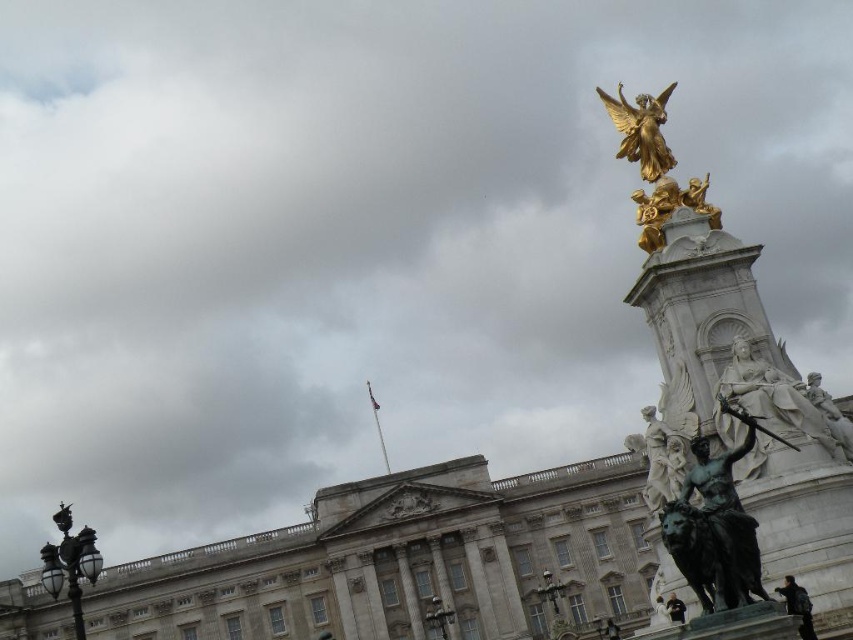
You are standing at the entrance of Buckingham Palace and want to take a photo of the bronze statue at right. Based on its position, which direction should you face to ensure the statue is centered in your camera view?

The bronze statue at right is located at point coordinates, so you should face towards the right side of the palace entrance to center it in your camera view.

In the scene shown: You are standing in front of Buckingham Palace and see the white marble statue at right and the gold polished statue at upper right. Which statue is positioned more to the right side?

The white marble statue at right is positioned more to the right than the gold polished statue at upper right.